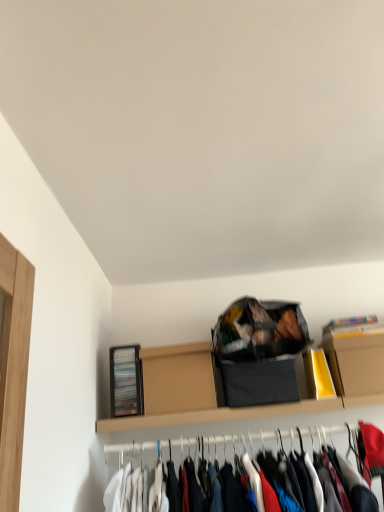
Question: From a real-world perspective, is matte black bag at upper center positioned under brown cardboard box at upper center, which ranks as the 1th cardboard box in left-to-right order, based on gravity?

Choices:
 (A) no
 (B) yes

Answer: (A)

Question: Is matte black bag at upper center directly adjacent to brown cardboard box at upper center, which appears as the second cardboard box when viewed from the right?

Choices:
 (A) yes
 (B) no

Answer: (B)

Question: Considering the relative sizes of matte black bag at upper center and brown cardboard box at upper center, which appears as the second cardboard box when viewed from the right, in the image provided, is matte black bag at upper center smaller than brown cardboard box at upper center, which appears as the second cardboard box when viewed from the right,?

Choices:
 (A) no
 (B) yes

Answer: (A)

Question: Is there a large distance between matte black bag at upper center and brown cardboard box at upper center, which ranks as the 1th cardboard box in left-to-right order?

Choices:
 (A) no
 (B) yes

Answer: (A)

Question: Considering the relative sizes of matte black bag at upper center and brown cardboard box at upper center, which ranks as the 1th cardboard box in left-to-right order, in the image provided, is matte black bag at upper center shorter than brown cardboard box at upper center, which ranks as the 1th cardboard box in left-to-right order,?

Choices:
 (A) no
 (B) yes

Answer: (A)

Question: Does matte black bag at upper center have a lesser width compared to brown cardboard box at upper center, which ranks as the 1th cardboard box in left-to-right order?

Choices:
 (A) no
 (B) yes

Answer: (A)

Question: Is brown cardboard box at upper center, which ranks as the 1th cardboard box in left-to-right order, next to matte black bag at upper center and touching it?

Choices:
 (A) no
 (B) yes

Answer: (A)

Question: Can you confirm if brown cardboard box at upper center, which ranks as the 1th cardboard box in left-to-right order, is smaller than matte black bag at upper center?

Choices:
 (A) no
 (B) yes

Answer: (B)

Question: Is matte black bag at upper center located within brown cardboard box at upper center, which appears as the second cardboard box when viewed from the right?

Choices:
 (A) yes
 (B) no

Answer: (B)

Question: Is brown cardboard box at upper center, which appears as the second cardboard box when viewed from the right, behind matte black bag at upper center?

Choices:
 (A) no
 (B) yes

Answer: (B)

Question: Does brown cardboard box at upper center, which appears as the second cardboard box when viewed from the right, appear on the right side of matte black bag at upper center?

Choices:
 (A) no
 (B) yes

Answer: (A)

Question: Considering the relative sizes of brown cardboard box at upper center, which appears as the second cardboard box when viewed from the right, and matte black bag at upper center in the image provided, is brown cardboard box at upper center, which appears as the second cardboard box when viewed from the right, thinner than matte black bag at upper center?

Choices:
 (A) no
 (B) yes

Answer: (B)

Question: Considering the relative sizes of cardboard box at upper right, arranged as the first cardboard box when viewed from the right, and matte black bag at upper center in the image provided, is cardboard box at upper right, arranged as the first cardboard box when viewed from the right, wider than matte black bag at upper center?

Choices:
 (A) yes
 (B) no

Answer: (B)